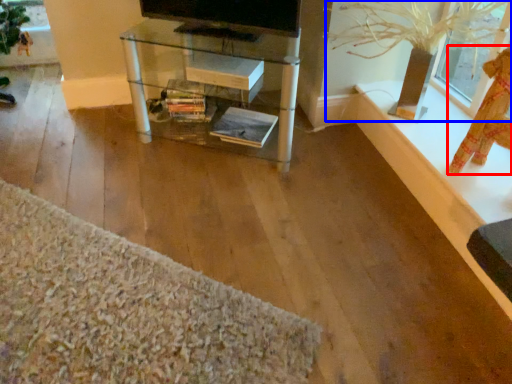
Question: Which point is closer to the camera, doll (highlighted by a red box) or plant (highlighted by a blue box)?

Choices:
 (A) doll
 (B) plant

Answer: (A)